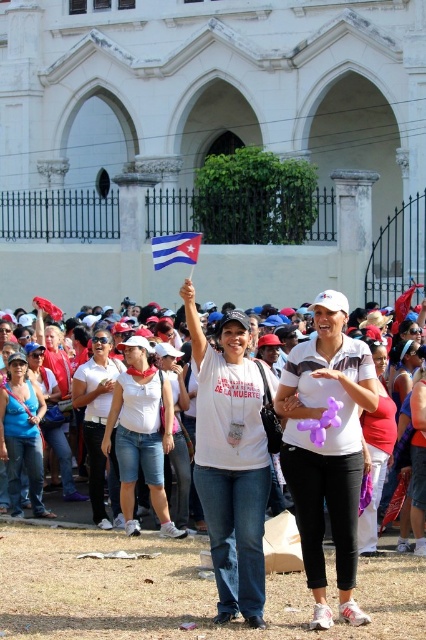
You are a photographer trying to capture both the denim shorts at center and the red fabric flag at center in the same frame. Based on their sizes, which object should you focus on first to ensure both are in the frame?

The denim shorts at center has a lesser height compared to the red fabric flag at center, so you should focus on the red fabric flag at center first to ensure both are in the frame.

You are a photographer trying to capture the Cuban flag clearly in your shot. You notice the matte white tank top at center and the blue fabric flag at center. Which object should you adjust to ensure the flag is visible?

The matte white tank top at center is in front of the blue fabric flag at center, so you should move the matte white tank top at center to reveal the flag.